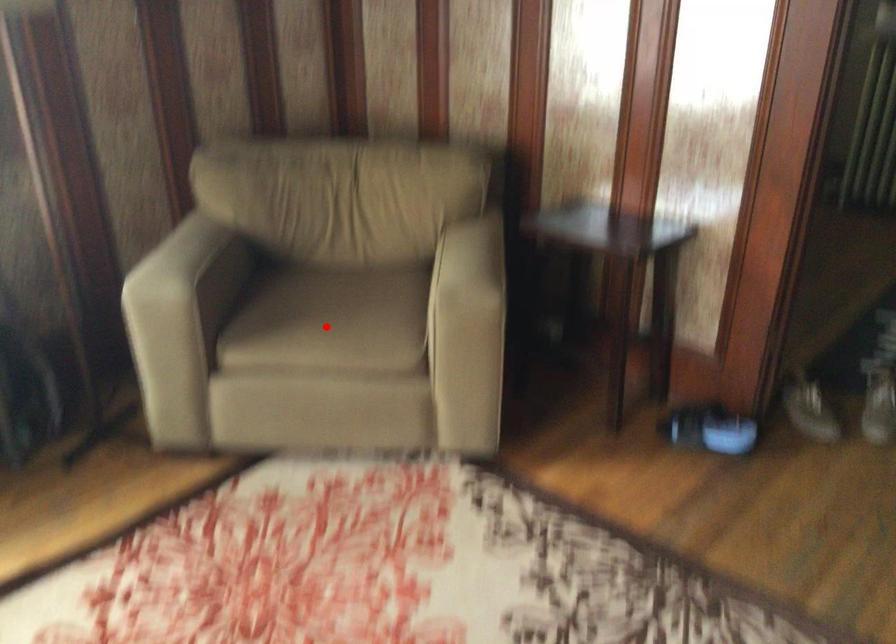
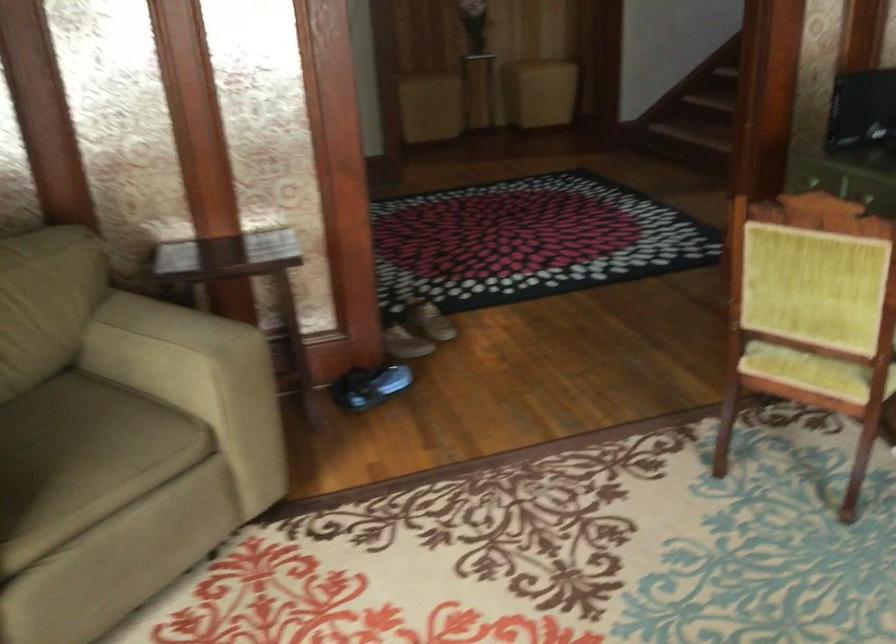
In the second image, find the point that corresponds to the highlighted location in the first image.

(82, 459)